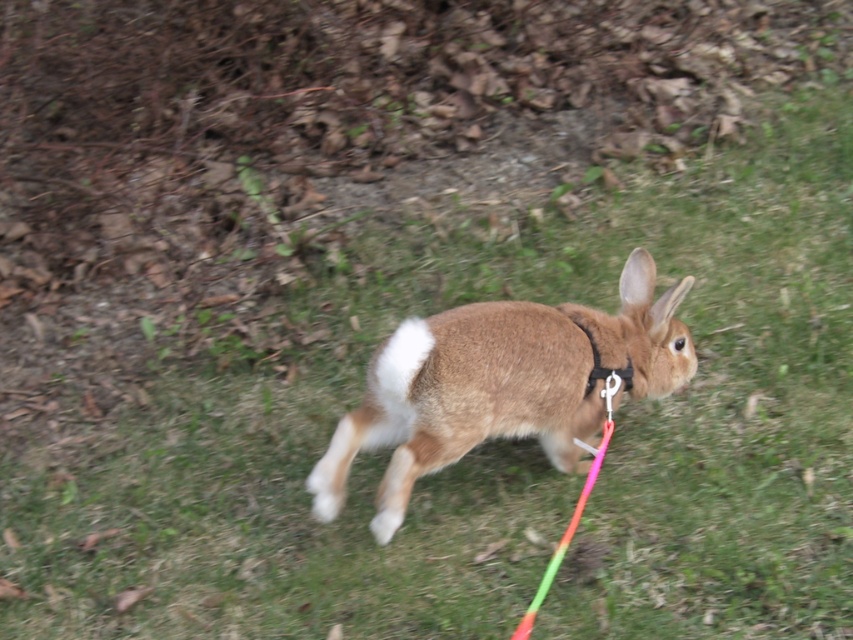
Based on the photo, you are a dog owner who wants to ensure your pet can walk comfortably next to the brown furry rabbit at center and the black fabric neckband at center. Which object should you avoid placing a leash on to prevent it from being too tight?

The black fabric neckband at center is narrower than the brown furry rabbit at center, so placing a leash on the black fabric neckband at center may be too tight and uncomfortable for the rabbit. Avoid using the black fabric neckband at center for the leash.

You are a pet owner who wants to ensure the brown furry rabbit at center can comfortably wear the black fabric neckband at center. Based on the scene, is the neckband likely to fit properly?

The brown furry rabbit at center has a greater height compared to the black fabric neckband at center, which suggests the neckband may be too small to fit comfortably around the rabbit.